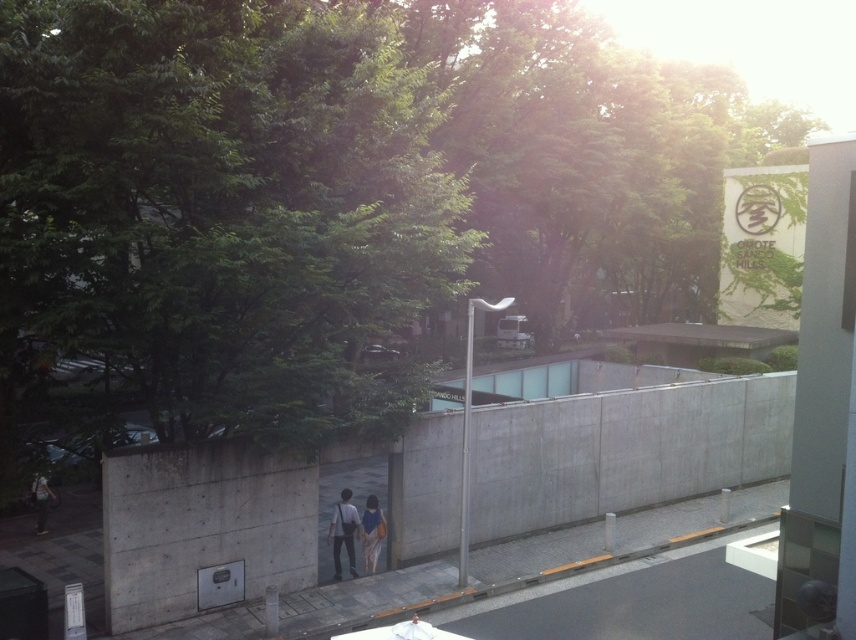
Does matte blue dress at center appear on the left side of blue fabric bag at center?

Yes, matte blue dress at center is to the left of blue fabric bag at center.

The width and height of the screenshot is (856, 640). I want to click on matte blue dress at center, so click(355, 532).

Is point (367, 540) in front of point (372, 566)?

Yes, it is in front of point (372, 566).

At what (x,y) coordinates should I click in order to perform the action: click on matte blue dress at center. Please return your answer as a coordinate pair (x, y). Looking at the image, I should click on point(355,532).

Does matte blue dress at center have a larger size compared to matte black jacket at lower left?

Yes, matte blue dress at center is bigger than matte black jacket at lower left.

Which is above, matte blue dress at center or matte black jacket at lower left?

matte blue dress at center is higher up.

Which is in front, point (369, 509) or point (43, 524)?

Positioned in front is point (369, 509).

The image size is (856, 640). In order to click on matte blue dress at center in this screenshot , I will do pos(355,532).

Can you confirm if blue fabric bag at center is thinner than matte black jacket at lower left?

Indeed, blue fabric bag at center has a lesser width compared to matte black jacket at lower left.

Is blue fabric bag at center bigger than matte black jacket at lower left?

Actually, blue fabric bag at center might be smaller than matte black jacket at lower left.

What are the coordinates of `blue fabric bag at center` in the screenshot? It's located at (372, 532).